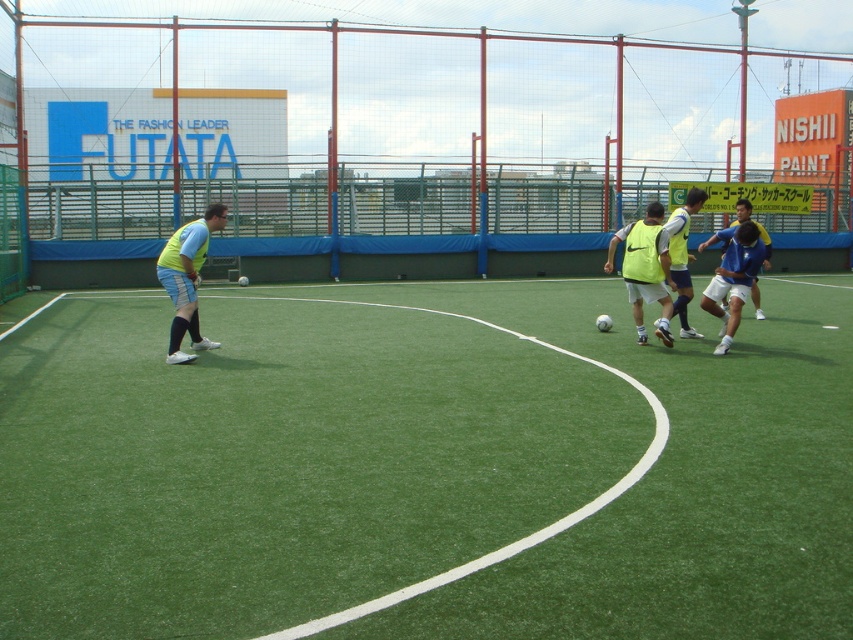
Does green artificial turf at center have a larger size compared to matte yellow vest at left?

Yes.

Who is taller, green artificial turf at center or matte yellow vest at left?

Standing taller between the two is matte yellow vest at left.

Describe the element at coordinates (277, 461) in the screenshot. I see `green artificial turf at center` at that location.

At what (x,y) coordinates should I click in order to perform the action: click on green artificial turf at center. Please return your answer as a coordinate pair (x, y). The height and width of the screenshot is (640, 853). Looking at the image, I should click on (277, 461).

Between green artificial turf at center and blue matte soccer ball at center, which one appears on the left side from the viewer's perspective?

Positioned to the left is green artificial turf at center.

Who is positioned more to the right, green artificial turf at center or blue matte soccer ball at center?

blue matte soccer ball at center

Between point (347, 356) and point (700, 300), which one is positioned in front?

Point (347, 356)

The image size is (853, 640). Find the location of `green artificial turf at center`. green artificial turf at center is located at coordinates (277, 461).

Measure the distance between matte yellow vest at left and matte yellow vest at center.

matte yellow vest at left is 5.00 meters from matte yellow vest at center.

Which is behind, point (175, 356) or point (653, 289)?

Positioned behind is point (653, 289).

Where is `matte yellow vest at left`? Image resolution: width=853 pixels, height=640 pixels. matte yellow vest at left is located at coordinates (187, 278).